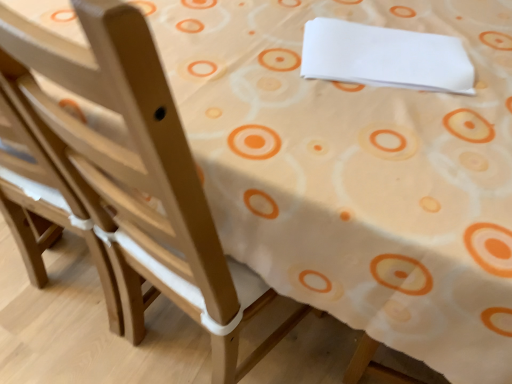
Describe the element at coordinates (385, 57) in the screenshot. The width and height of the screenshot is (512, 384). I see `white paper at upper right` at that location.

You are a GUI agent. You are given a task and a screenshot of the screen. Output one action in this format:
    pyautogui.click(x=<x>, y=<y>)
    Task: Click on the white paper at upper right
    The width and height of the screenshot is (512, 384).
    Given the screenshot: What is the action you would take?
    pyautogui.click(x=385, y=57)

What is the approximate height of light wood chair at left?

It is 35.83 inches.

What do you see at coordinates (134, 178) in the screenshot? The height and width of the screenshot is (384, 512). I see `light wood chair at left` at bounding box center [134, 178].

Find the location of a particular element. This screenshot has height=384, width=512. light wood chair at left is located at coordinates (134, 178).

Locate an element on the screen. Image resolution: width=512 pixels, height=384 pixels. white paper at upper right is located at coordinates (385, 57).

Is light wood chair at left at the right side of white paper at upper right?

No.

Is the position of light wood chair at left more distant than that of white paper at upper right?

No, light wood chair at left is in front of white paper at upper right.

Does point (217, 275) appear closer or farther from the camera than point (313, 42)?

Point (217, 275) is closer to the camera than point (313, 42).

From the image's perspective, is light wood chair at left positioned above or below white paper at upper right?

From the image's perspective, light wood chair at left appears below white paper at upper right.

From a real-world perspective, is light wood chair at left located beneath white paper at upper right?

Yes, from a real-world perspective, light wood chair at left is under white paper at upper right.

Considering the relative sizes of light wood chair at left and white paper at upper right in the image provided, is light wood chair at left wider than white paper at upper right?

Indeed, light wood chair at left has a greater width compared to white paper at upper right.

Can you confirm if light wood chair at left is shorter than white paper at upper right?

In fact, light wood chair at left may be taller than white paper at upper right.

Can you confirm if light wood chair at left is bigger than white paper at upper right?

Yes.

Choose the correct answer: Is light wood chair at left inside white paper at upper right or outside it?

light wood chair at left is spatially situated outside white paper at upper right.

Is light wood chair at left with white paper at upper right?

light wood chair at left and white paper at upper right are not in contact.

Is light wood chair at left facing towards white paper at upper right?

No.

The width and height of the screenshot is (512, 384). What are the coordinates of `chair that appears below the white paper at upper right (from the image's perspective)` in the screenshot? It's located at (134, 178).

Considering the positions of objects white paper at upper right and light wood chair at left in the image provided, who is more to the right, white paper at upper right or light wood chair at left?

white paper at upper right is more to the right.

Is white paper at upper right positioned before light wood chair at left?

No, white paper at upper right is further to the viewer.

Does point (331, 73) appear closer or farther from the camera than point (163, 237)?

Clearly, point (331, 73) is more distant from the camera than point (163, 237).

From the image's perspective, who appears lower, white paper at upper right or light wood chair at left?

light wood chair at left.

From a real-world perspective, between white paper at upper right and light wood chair at left, who is vertically higher?

From a 3D spatial view, white paper at upper right is above.

Which object is wider, white paper at upper right or light wood chair at left?

light wood chair at left.

From the picture: Between white paper at upper right and light wood chair at left, which one has more height?

light wood chair at left.

Does white paper at upper right have a smaller size compared to light wood chair at left?

Yes.

Looking at this image, is white paper at upper right surrounding light wood chair at left?

No, light wood chair at left is located outside of white paper at upper right.

Consider the image. Is white paper at upper right not close to light wood chair at left?

They are positioned close to each other.

Is white paper at upper right facing away from light wood chair at left?

No.

What's the angular difference between white paper at upper right and light wood chair at left's facing directions?

The facing directions of white paper at upper right and light wood chair at left are 107 degrees apart.

How far apart are white paper at upper right and light wood chair at left?

They are 19.38 inches apart.

This screenshot has height=384, width=512. I want to click on linen that is on the right side of light wood chair at left, so click(385, 57).

Locate an element on the screen. linen that is above the light wood chair at left (from a real-world perspective) is located at coordinates (385, 57).

Identify the location of chair in front of the white paper at upper right. The height and width of the screenshot is (384, 512). click(134, 178).